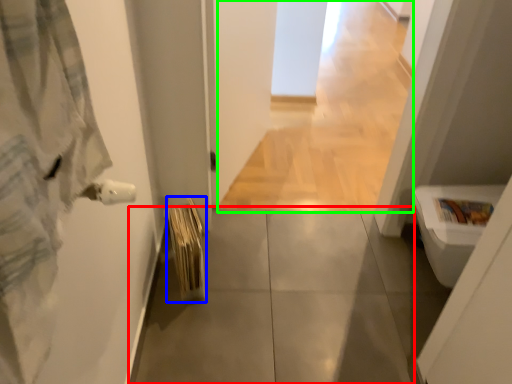
Question: Which object is positioned farthest from concrete (highlighted by a red box)? Select from bath towel (highlighted by a blue box) and corridor (highlighted by a green box).

Choices:
 (A) bath towel
 (B) corridor

Answer: (B)